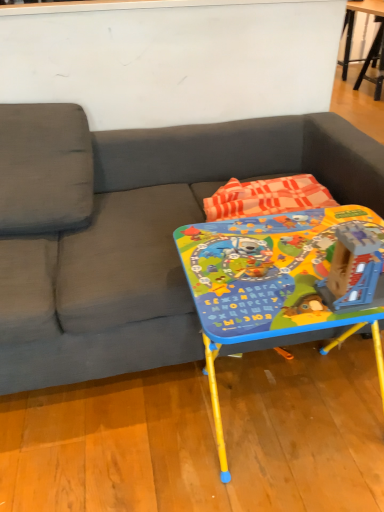
Locate an element on the screen. The image size is (384, 512). vacant space underneath wooden table at upper right, which appears as the 2th table when ordered from the bottom (from a real-world perspective) is located at coordinates (345, 62).